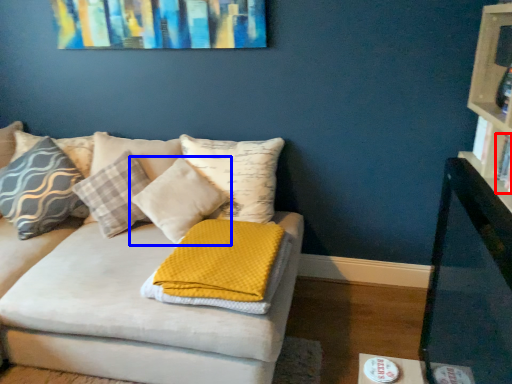
Question: Which of the following is the farthest to the observer, book (highlighted by a red box) or pillow (highlighted by a blue box)?

Choices:
 (A) book
 (B) pillow

Answer: (B)